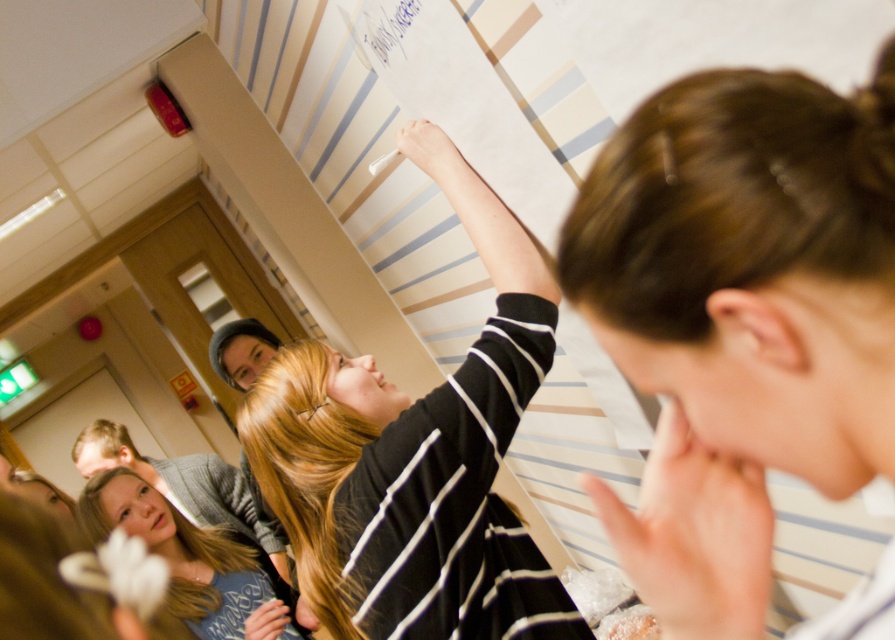
Looking at this image, you are a photographer trying to capture a group photo of the people in the scene. You need to ensure that everyone is visible. Given that the brown hair at upper right and the blonde hair at lower left are in the frame, which person should you adjust to be more visible?

The brown hair at upper right is shorter than the blonde hair at lower left, so you should adjust the brown hair at upper right to ensure it is visible in the photo.

You are a photographer trying to capture a candid shot of the person with brown hair at upper right without including the person with blonde hair at lower left in the frame. Based on their positions, can you position yourself to do so?

The brown hair at upper right is in front of blonde hair at lower left, so positioning yourself to focus on the brown hair at upper right while angling the camera slightly upwards should allow you to exclude the blonde hair at lower left from the frame.

You are an observer in the room. You notice the black striped sweater at upper center and the blue ink writing at upper center on the whiteboard. Which object is positioned higher up on the whiteboard?

The black striped sweater at upper center is taller than the blue ink writing at upper center, so the black striped sweater at upper center is positioned higher up on the whiteboard.